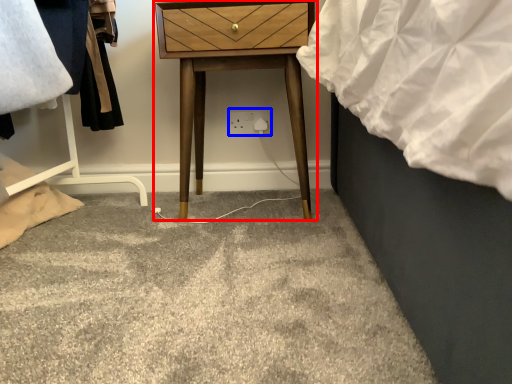
Question: Which of the following is the closest to the observer, nightstand (highlighted by a red box) or electric outlet (highlighted by a blue box)?

Choices:
 (A) nightstand
 (B) electric outlet

Answer: (A)